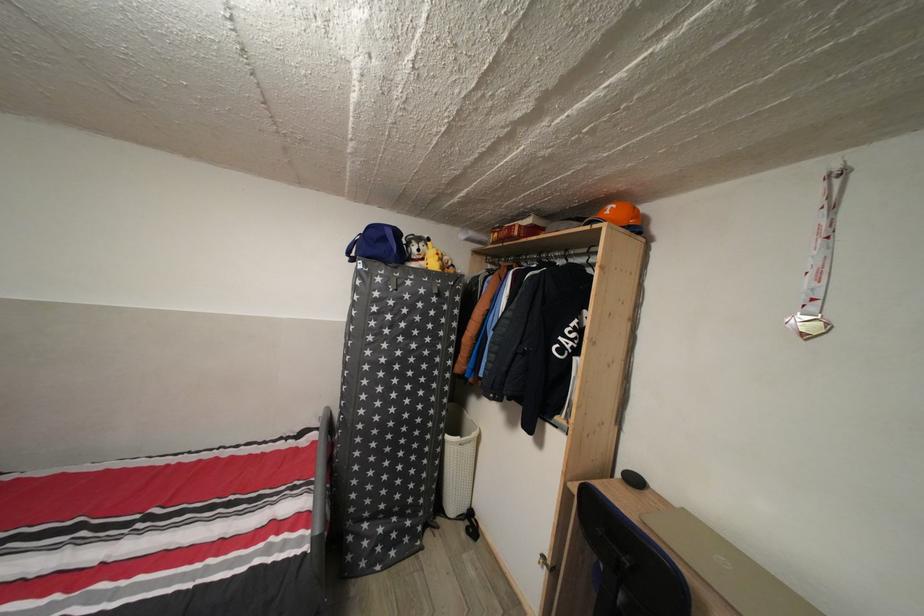
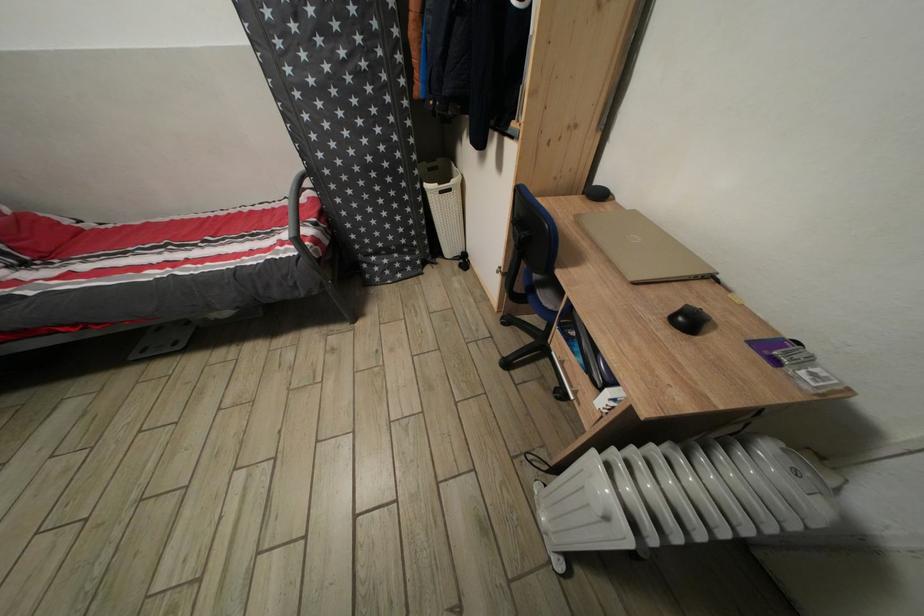
Find the pixel in the second image that matches point 455,444 in the first image.

(432, 192)